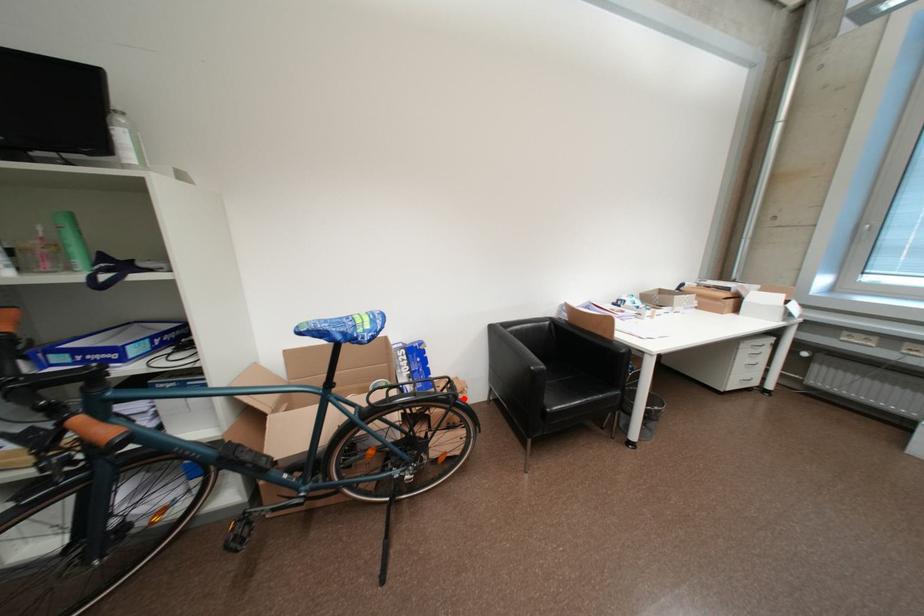
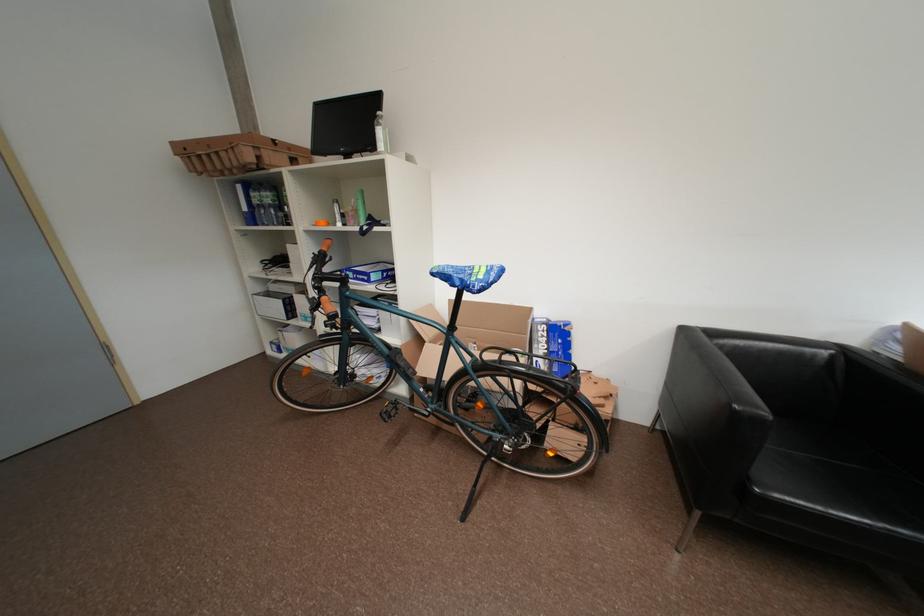
In the second image, find the point that corresponds to the highlighted location in the first image.

(582, 391)